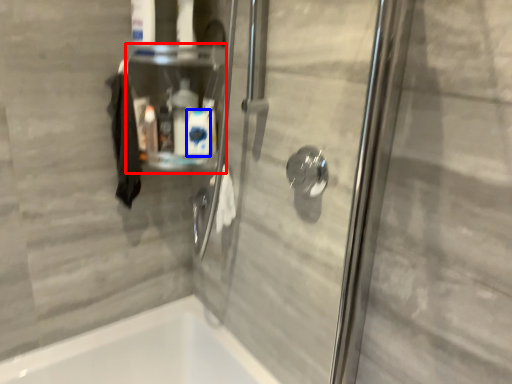
Question: Which object appears farthest to the camera in this image, shelf (highlighted by a red box) or cleaning product (highlighted by a blue box)?

Choices:
 (A) shelf
 (B) cleaning product

Answer: (B)